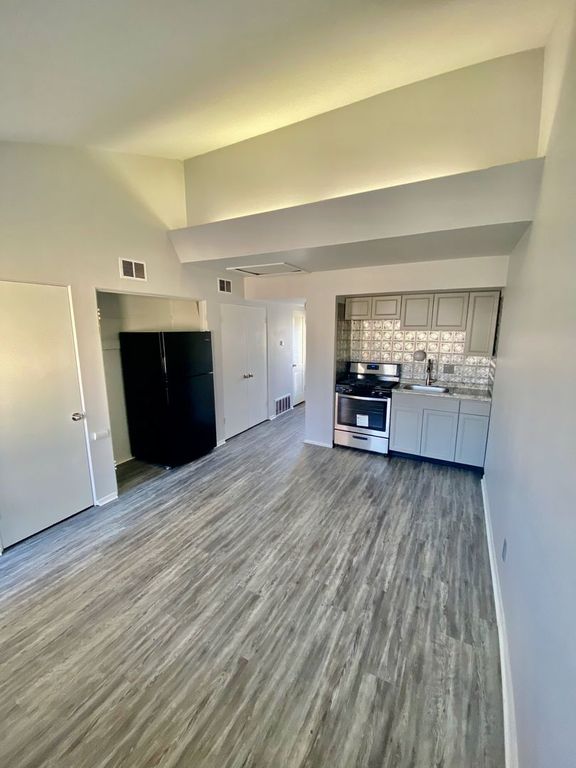
Identify the location of knob. Image resolution: width=576 pixels, height=768 pixels. (79, 412).